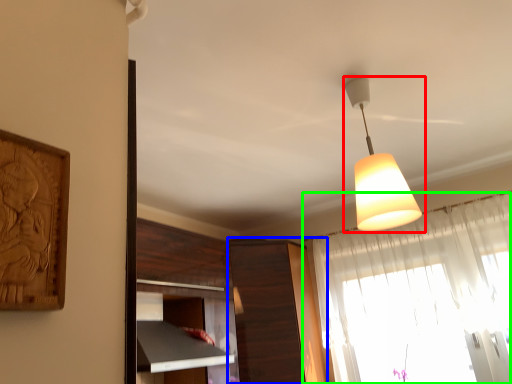
Question: Estimate the real-world distances between objects in this image. Which object is closer to lamp (highlighted by a red box), cabinetry (highlighted by a blue box) or curtain (highlighted by a green box)?

Choices:
 (A) cabinetry
 (B) curtain

Answer: (B)